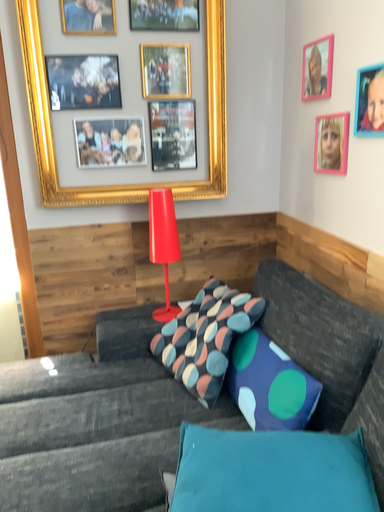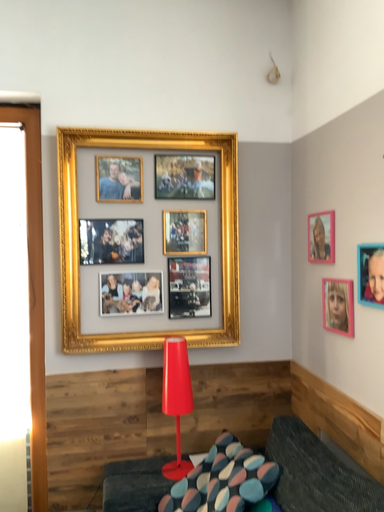
Question: How did the camera likely rotate when shooting the video?

Choices:
 (A) rotated upward
 (B) rotated downward

Answer: (A)